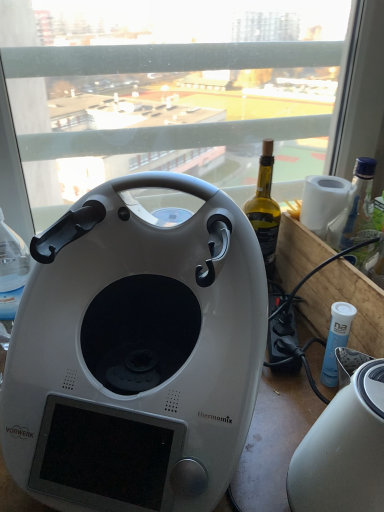
Identify the location of white glossy thermomix at center. Image resolution: width=384 pixels, height=512 pixels. (136, 352).

What is the approximate width of transparent glass window at center?

It is 3.81 inches.

Image resolution: width=384 pixels, height=512 pixels. Find the location of `transparent glass window at center`. transparent glass window at center is located at coordinates (183, 95).

I want to click on white glossy thermomix at center, so [x=136, y=352].

In the scene shown: Is transparent glass window at center positioned far away from white glossy thermomix at center?

No, transparent glass window at center is in close proximity to white glossy thermomix at center.

I want to click on window behind the white glossy thermomix at center, so click(x=183, y=95).

Is transparent glass window at center positioned with its back to white glossy thermomix at center?

Yes, transparent glass window at center is positioned with its back facing white glossy thermomix at center.

Which is more to the left, white glossy toaster at lower right or transparent glass window at center?

transparent glass window at center.

Does white glossy toaster at lower right have a greater width compared to transparent glass window at center?

Indeed, white glossy toaster at lower right has a greater width compared to transparent glass window at center.

Considering the positions of objects white glossy toaster at lower right and transparent glass window at center in the image provided, who is in front, white glossy toaster at lower right or transparent glass window at center?

white glossy toaster at lower right.

Is white glossy toaster at lower right oriented towards transparent glass window at center?

No, white glossy toaster at lower right is not aimed at transparent glass window at center.

Is transparent glass window at center not within white glossy toaster at lower right?

Indeed, transparent glass window at center is completely outside white glossy toaster at lower right.

From a real-world perspective, is transparent glass window at center physically above white glossy toaster at lower right?

Yes, from a real-world perspective, transparent glass window at center is above white glossy toaster at lower right.

Can you confirm if transparent glass window at center is bigger than white glossy toaster at lower right?

Indeed, transparent glass window at center has a larger size compared to white glossy toaster at lower right.

Is white glossy toaster at lower right not close to white glossy thermomix at center?

No, white glossy toaster at lower right is in close proximity to white glossy thermomix at center.

Considering the relative positions of white glossy toaster at lower right and white glossy thermomix at center in the image provided, is white glossy toaster at lower right behind white glossy thermomix at center?

That is False.

Looking at the image, does white glossy toaster at lower right seem bigger or smaller compared to white glossy thermomix at center?

In the image, white glossy toaster at lower right appears to be smaller than white glossy thermomix at center.

From the image's perspective, is white glossy thermomix at center on top of white glossy toaster at lower right?

Indeed, from the image's perspective, white glossy thermomix at center is shown above white glossy toaster at lower right.

Is point (108, 424) farther from camera compared to point (348, 387)?

Yes, it is.

From the picture: Looking at the image, does white glossy thermomix at center seem bigger or smaller compared to white glossy toaster at lower right?

Clearly, white glossy thermomix at center is larger in size than white glossy toaster at lower right.

Is white glossy thermomix at center not within white glossy toaster at lower right?

Absolutely, white glossy thermomix at center is external to white glossy toaster at lower right.

Based on their sizes in the image, would you say white glossy thermomix at center is bigger or smaller than transparent glass window at center?

Clearly, white glossy thermomix at center is smaller in size than transparent glass window at center.

Measure the distance from white glossy thermomix at center to transparent glass window at center.

white glossy thermomix at center and transparent glass window at center are 14.35 inches apart from each other.

Considering their positions, is white glossy thermomix at center located in front of or behind transparent glass window at center?

In the image, white glossy thermomix at center appears in front of transparent glass window at center.

The height and width of the screenshot is (512, 384). What are the coordinates of `home appliance located on the left of transparent glass window at center` in the screenshot? It's located at (136, 352).

This screenshot has height=512, width=384. I want to click on toaster lying on the right of transparent glass window at center, so click(343, 450).

From the image, which object appears to be nearer to white glossy toaster at lower right, white glossy thermomix at center or transparent glass window at center?

white glossy thermomix at center.

Which object lies further to the anchor point transparent glass window at center, white glossy thermomix at center or white glossy toaster at lower right?

Based on the image, white glossy toaster at lower right appears to be further to transparent glass window at center.

Based on their spatial positions, is transparent glass window at center or white glossy thermomix at center closer to white glossy toaster at lower right?

Among the two, white glossy thermomix at center is located nearer to white glossy toaster at lower right.

In the scene shown: Estimate the real-world distances between objects in this image. Which object is further from transparent glass window at center, white glossy toaster at lower right or white glossy thermomix at center?

white glossy toaster at lower right lies further to transparent glass window at center than the other object.

When comparing their distances from white glossy thermomix at center, does transparent glass window at center or white glossy toaster at lower right seem closer?

Based on the image, white glossy toaster at lower right appears to be nearer to white glossy thermomix at center.

When comparing their distances from white glossy thermomix at center, does white glossy toaster at lower right or transparent glass window at center seem further?

transparent glass window at center is further to white glossy thermomix at center.

Find the location of `home appliance between transparent glass window at center and white glossy toaster at lower right in the vertical direction`. home appliance between transparent glass window at center and white glossy toaster at lower right in the vertical direction is located at coordinates pyautogui.click(x=136, y=352).